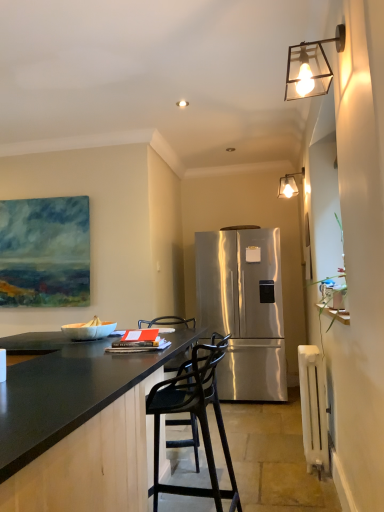
Describe the element at coordinates (88, 330) in the screenshot. This screenshot has height=512, width=384. I see `white glossy bowl at lower left` at that location.

At what (x,y) coordinates should I click in order to perform the action: click on stainless steel refrigerator at center. Please return your answer as a coordinate pair (x, y). This screenshot has height=512, width=384. Looking at the image, I should click on (244, 310).

You are a GUI agent. You are given a task and a screenshot of the screen. Output one action in this format:
    pyautogui.click(x=<x>, y=<y>)
    Task: Click on the black matte bar stool at center
    
    Given the screenshot: What is the action you would take?
    point(196,416)

At what (x,y) coordinates should I click in order to perform the action: click on metallic glass wall sconce at upper right, which ranks as the second lamp in back-to-front order. Please return your answer as a coordinate pair (x, y). The image size is (384, 512). Looking at the image, I should click on (311, 67).

What do you see at coordinates (65, 389) in the screenshot? I see `black granite countertop at center` at bounding box center [65, 389].

This screenshot has width=384, height=512. What are the coordinates of `metallic glass lampshade at upper right, marked as the first lamp in a right-to-left arrangement` in the screenshot? It's located at (289, 184).

Considering the points (106, 336) and (317, 53), which point is behind, point (106, 336) or point (317, 53)?

Point (106, 336)

Does white glossy bowl at lower left have a smaller size compared to metallic glass wall sconce at upper right, which ranks as the second lamp in back-to-front order?

Correct, white glossy bowl at lower left occupies less space than metallic glass wall sconce at upper right, which ranks as the second lamp in back-to-front order.

Is the position of white glossy bowl at lower left less distant than that of metallic glass wall sconce at upper right, which appears as the second lamp when viewed from the right?

No, the depth of white glossy bowl at lower left is greater than that of metallic glass wall sconce at upper right, which appears as the second lamp when viewed from the right.

Is white glossy bowl at lower left aimed at metallic glass wall sconce at upper right, which appears as the first lamp when viewed from the left?

No, white glossy bowl at lower left is not oriented towards metallic glass wall sconce at upper right, which appears as the first lamp when viewed from the left.

Which is nearer, [302,168] or [26,423]?

The point [26,423] is more forward.

Based on the photo, from the image's perspective, relative to black granite countertop at center, is metallic glass lampshade at upper right, which ranks as the second lamp in front-to-back order, above or below?

From the image's perspective, metallic glass lampshade at upper right, which ranks as the second lamp in front-to-back order, appears above black granite countertop at center.

Can you confirm if metallic glass lampshade at upper right, which ranks as the second lamp in front-to-back order, is bigger than black granite countertop at center?

Incorrect, metallic glass lampshade at upper right, which ranks as the second lamp in front-to-back order, is not larger than black granite countertop at center.

Is black granite countertop at center surrounded by metallic glass lampshade at upper right, which ranks as the 2th lamp in left-to-right order?

No, black granite countertop at center is located outside of metallic glass lampshade at upper right, which ranks as the 2th lamp in left-to-right order.

Image resolution: width=384 pixels, height=512 pixels. Find the location of `lamp that is the 1st one when counting upward from the white painted radiator at lower right (from the image's perspective)`. lamp that is the 1st one when counting upward from the white painted radiator at lower right (from the image's perspective) is located at coordinates click(289, 184).

From the image's perspective, does metallic glass lampshade at upper right, the 1th lamp from the back, appear lower than white painted radiator at lower right?

Incorrect, from the image's perspective, metallic glass lampshade at upper right, the 1th lamp from the back, is higher than white painted radiator at lower right.

Is metallic glass lampshade at upper right, which ranks as the 2th lamp in left-to-right order, next to white painted radiator at lower right and touching it?

metallic glass lampshade at upper right, which ranks as the 2th lamp in left-to-right order, and white painted radiator at lower right are not in contact.

Considering the positions of point (278, 396) and point (302, 176), is point (278, 396) closer or farther from the camera than point (302, 176)?

Point (278, 396) is positioned farther from the camera compared to point (302, 176).

Is the surface of stainless steel refrigerator at center in direct contact with metallic glass lampshade at upper right, which ranks as the second lamp in front-to-back order?

No, stainless steel refrigerator at center is not touching metallic glass lampshade at upper right, which ranks as the second lamp in front-to-back order.

Which is in front, point (112, 323) or point (291, 177)?

The point (112, 323) is in front.

Considering their positions, is white glossy bowl at lower left located in front of or behind metallic glass lampshade at upper right, the 1th lamp from the back?

white glossy bowl at lower left is in front of metallic glass lampshade at upper right, the 1th lamp from the back.

Is white glossy bowl at lower left positioned far away from metallic glass lampshade at upper right, the 1th lamp from the back?

That's right, there is a large distance between white glossy bowl at lower left and metallic glass lampshade at upper right, the 1th lamp from the back.

Can you tell me how much stainless steel refrigerator at center and white glossy bowl at lower left differ in facing direction?

The facing directions of stainless steel refrigerator at center and white glossy bowl at lower left are 1.65 degrees apart.

From the image's perspective, is stainless steel refrigerator at center below white glossy bowl at lower left?

Yes.

Does point (242, 262) come farther from viewer compared to point (75, 334)?

Yes.

Does stainless steel refrigerator at center appear on the left side of white glossy bowl at lower left?

No, stainless steel refrigerator at center is not to the left of white glossy bowl at lower left.

Which of these two, black granite countertop at center or white painted radiator at lower right, stands shorter?

white painted radiator at lower right.

This screenshot has height=512, width=384. Find the location of `radiator to the right of black granite countertop at center`. radiator to the right of black granite countertop at center is located at coordinates (313, 408).

Does black granite countertop at center have a larger size compared to white painted radiator at lower right?

Correct, black granite countertop at center is larger in size than white painted radiator at lower right.

What are the coordinates of `the 2nd lamp above the white glossy bowl at lower left (from the image's perspective)` in the screenshot? It's located at (311, 67).

Locate an element on the screen. This screenshot has height=512, width=384. countertop below the metallic glass lampshade at upper right, marked as the first lamp in a right-to-left arrangement (from a real-world perspective) is located at coordinates (65, 389).

Considering their positions, is black matte bar stool at center positioned closer to white painted radiator at lower right than stainless steel refrigerator at center?

black matte bar stool at center is closer to white painted radiator at lower right.

Based on their spatial positions, is metallic glass wall sconce at upper right, which appears as the second lamp when viewed from the right, or black granite countertop at center further from stainless steel refrigerator at center?

Based on the image, metallic glass wall sconce at upper right, which appears as the second lamp when viewed from the right, appears to be further to stainless steel refrigerator at center.

Considering their positions, is white painted radiator at lower right positioned further to black matte bar stool at center than stainless steel refrigerator at center?

stainless steel refrigerator at center lies further to black matte bar stool at center than the other object.

When comparing their distances from stainless steel refrigerator at center, does black matte bar stool at center or metallic glass wall sconce at upper right, arranged as the 1th lamp when viewed from the front, seem further?

metallic glass wall sconce at upper right, arranged as the 1th lamp when viewed from the front, is positioned further to the anchor stainless steel refrigerator at center.

Based on their spatial positions, is black granite countertop at center or white painted radiator at lower right further from metallic glass wall sconce at upper right, which appears as the second lamp when viewed from the right?

white painted radiator at lower right lies further to metallic glass wall sconce at upper right, which appears as the second lamp when viewed from the right, than the other object.

Based on their spatial positions, is black granite countertop at center or metallic glass lampshade at upper right, which ranks as the second lamp in front-to-back order, closer to black matte bar stool at center?

black granite countertop at center lies closer to black matte bar stool at center than the other object.

Which object lies nearer to the anchor point black granite countertop at center, metallic glass wall sconce at upper right, which appears as the first lamp when viewed from the left, or stainless steel refrigerator at center?

Among the two, metallic glass wall sconce at upper right, which appears as the first lamp when viewed from the left, is located nearer to black granite countertop at center.

Looking at the image, which one is located closer to black granite countertop at center, metallic glass lampshade at upper right, which ranks as the second lamp in front-to-back order, or metallic glass wall sconce at upper right, which ranks as the second lamp in back-to-front order?

Among the two, metallic glass wall sconce at upper right, which ranks as the second lamp in back-to-front order, is located nearer to black granite countertop at center.

This screenshot has height=512, width=384. I want to click on bowl that lies between metallic glass wall sconce at upper right, which appears as the second lamp when viewed from the right, and black granite countertop at center from top to bottom, so click(88, 330).

Locate an element on the screen. chair between metallic glass wall sconce at upper right, which ranks as the second lamp in back-to-front order, and black granite countertop at center, in the vertical direction is located at coordinates (196, 416).

Find the location of a particular element. This screenshot has height=512, width=384. countertop positioned between metallic glass wall sconce at upper right, which ranks as the second lamp in back-to-front order, and metallic glass lampshade at upper right, the 1th lamp from the back, from near to far is located at coordinates (65, 389).

Locate an element on the screen. This screenshot has width=384, height=512. bowl between black matte bar stool at center and stainless steel refrigerator at center from front to back is located at coordinates (88, 330).